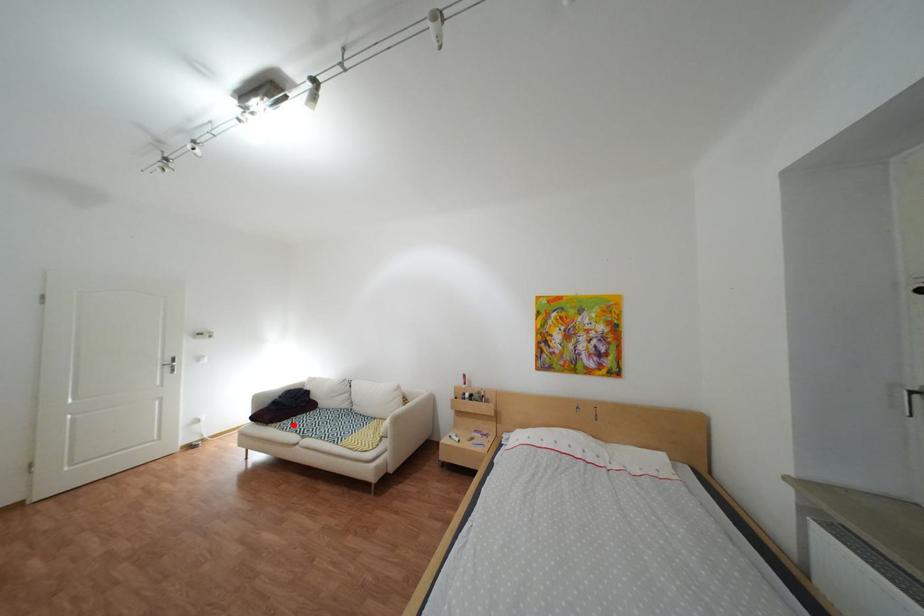
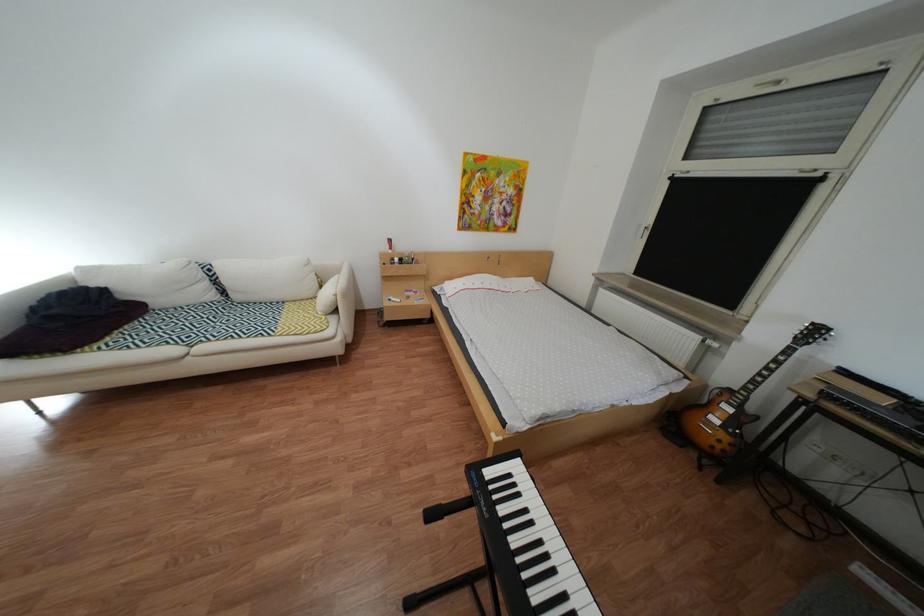
The point at the highlighted location is marked in the first image. Where is the corresponding point in the second image?

(113, 346)